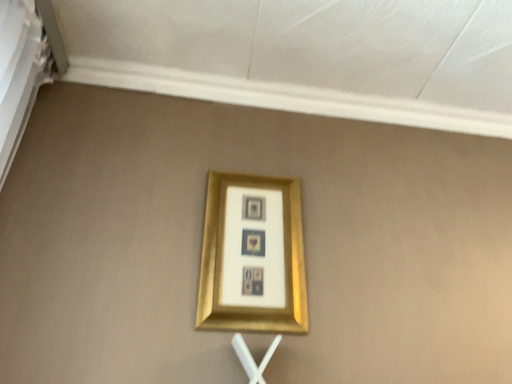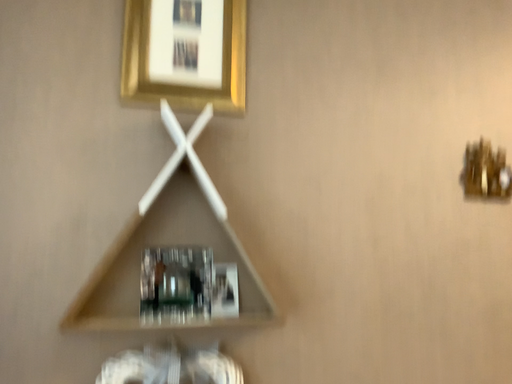
Question: Which way did the camera rotate in the video?

Choices:
 (A) rotated upward
 (B) rotated downward

Answer: (B)